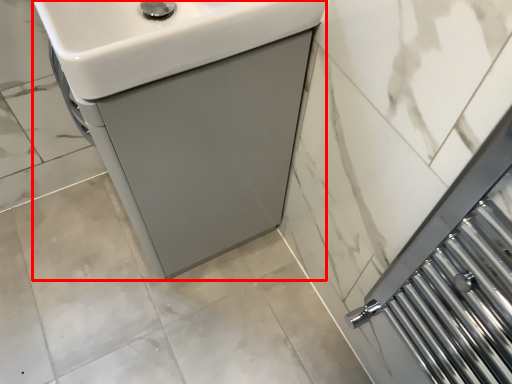
Question: Considering the relative positions of sink (annotated by the red box) and sink in the image provided, where is sink (annotated by the red box) located with respect to the staircase?

Choices:
 (A) right
 (B) left

Answer: (B)